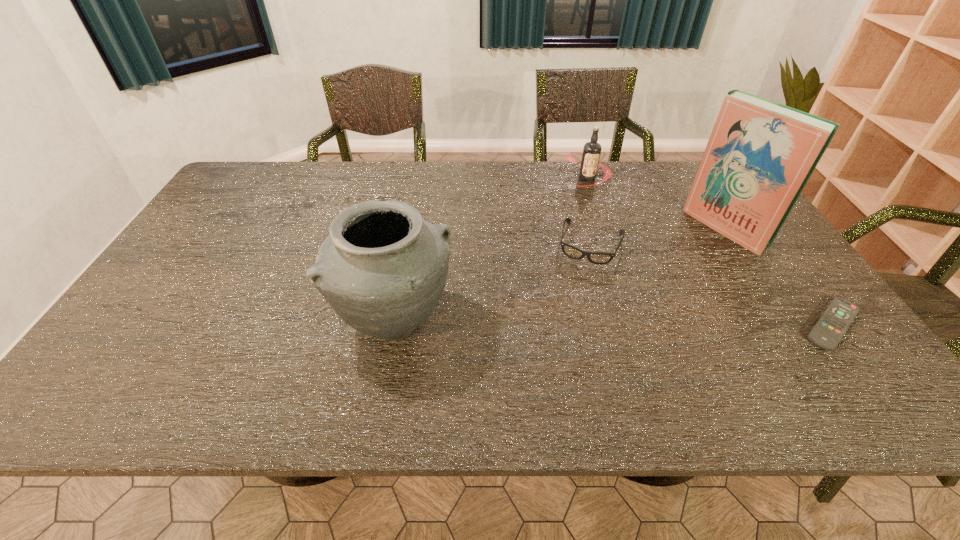
The image size is (960, 540). What are the coordinates of `vacant space in between the tallest object and the remote control` in the screenshot? It's located at (779, 276).

Identify the location of vacant area between the hardback book and the root beer. (656, 203).

Where is `vacant space that is in between the third shortest object and the urn`? Image resolution: width=960 pixels, height=540 pixels. vacant space that is in between the third shortest object and the urn is located at coordinates (492, 251).

Find the location of a particular element. unoccupied position between the root beer and the second shortest object is located at coordinates (588, 211).

Identify the location of vacant space in between the hardback book and the spectacles. (658, 236).

Where is `vacant point located between the second shortest object and the urn`? vacant point located between the second shortest object and the urn is located at coordinates (493, 284).

Where is `free area in between the leftmost object and the second shortest object`? This screenshot has width=960, height=540. free area in between the leftmost object and the second shortest object is located at coordinates (493, 284).

The height and width of the screenshot is (540, 960). I want to click on free space that is in between the third tallest object and the urn, so click(x=492, y=251).

Where is `unoccupied area between the spectacles and the second tallest object`? The height and width of the screenshot is (540, 960). unoccupied area between the spectacles and the second tallest object is located at coordinates (493, 284).

Identify the location of vacant area between the farthest object and the second tallest object. (492, 251).